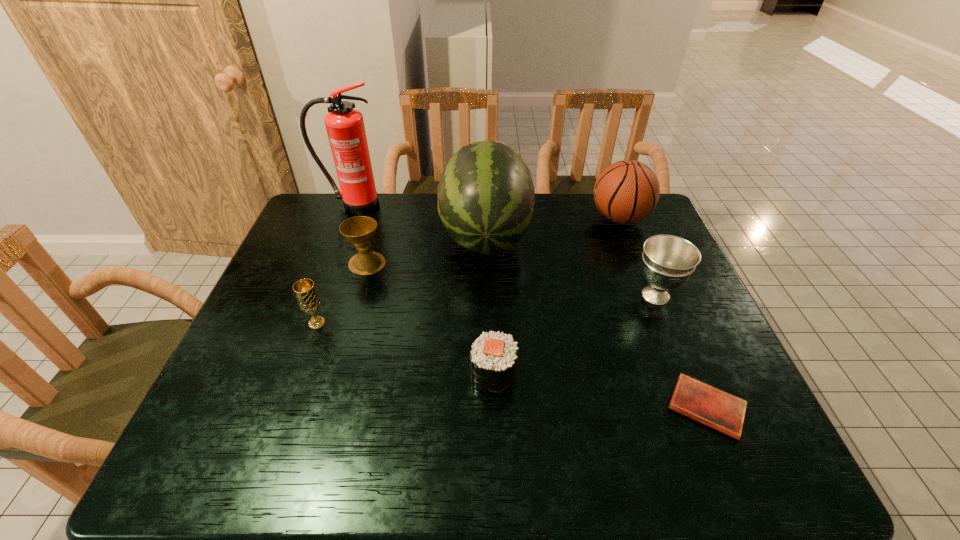
Image resolution: width=960 pixels, height=540 pixels. I want to click on vacant area located at the nozzle of the tallest object, so click(328, 274).

Find the location of a particular element. The height and width of the screenshot is (540, 960). free space located 0.110m on the left of the second tallest object is located at coordinates (405, 234).

The width and height of the screenshot is (960, 540). Identify the location of free location located on the side where the inflation valve is located. (495, 218).

Identify the location of free location located 0.330m on the side where the inflation valve is located. The width and height of the screenshot is (960, 540). (490, 218).

You are a GUI agent. You are given a task and a screenshot of the screen. Output one action in this format:
    pyautogui.click(x=<x>, y=<y>)
    Task: Click on the free location located on the side where the inflation valve is located
    Image resolution: width=960 pixels, height=540 pixels.
    Given the screenshot: What is the action you would take?
    pyautogui.click(x=511, y=218)

Identify the location of free spot located on the back of the second nearest chalice. Image resolution: width=960 pixels, height=540 pixels. (618, 203).

I want to click on vacant space located on the right of the second chalice from left to right, so click(x=444, y=263).

The image size is (960, 540). Find the location of `vacant space located 0.320m on the right of the leftmost chalice`. vacant space located 0.320m on the right of the leftmost chalice is located at coordinates (453, 323).

Locate an element on the screen. vacant region located 0.050m on the left of the seventh tallest object is located at coordinates (448, 375).

What are the coordinates of `vacant area located 0.340m on the back of the shortest object` in the screenshot? It's located at (652, 275).